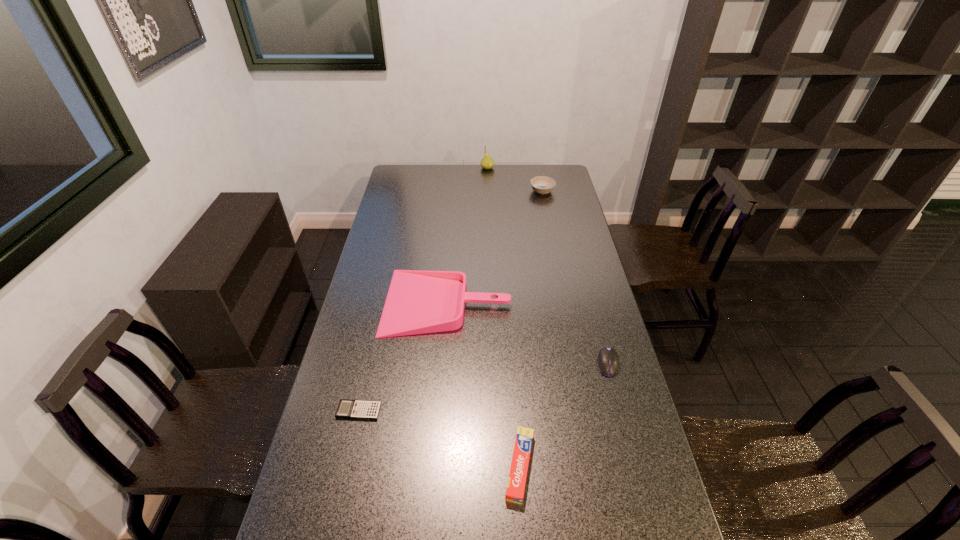
At what (x,y) coordinates should I click in order to perform the action: click on vacant space that satisfies the following two spatial constraints: 1. on the handle side of the rightmost object; 2. on the left side of the dustpan. Please return your answer as a coordinate pair (x, y). Looking at the image, I should click on (443, 363).

I want to click on free space that satisfies the following two spatial constraints: 1. on the back side of the shortest object; 2. on the right side of the pear, so click(x=414, y=168).

Identify the location of vacant space that satisfies the following two spatial constraints: 1. on the handle side of the toothpaste; 2. on the left side of the fourth nearest object. (434, 467).